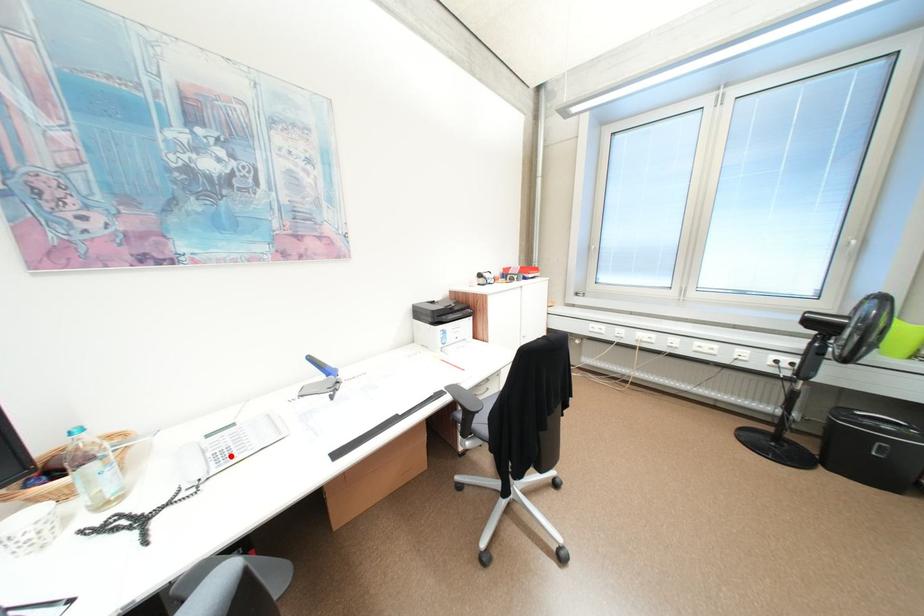
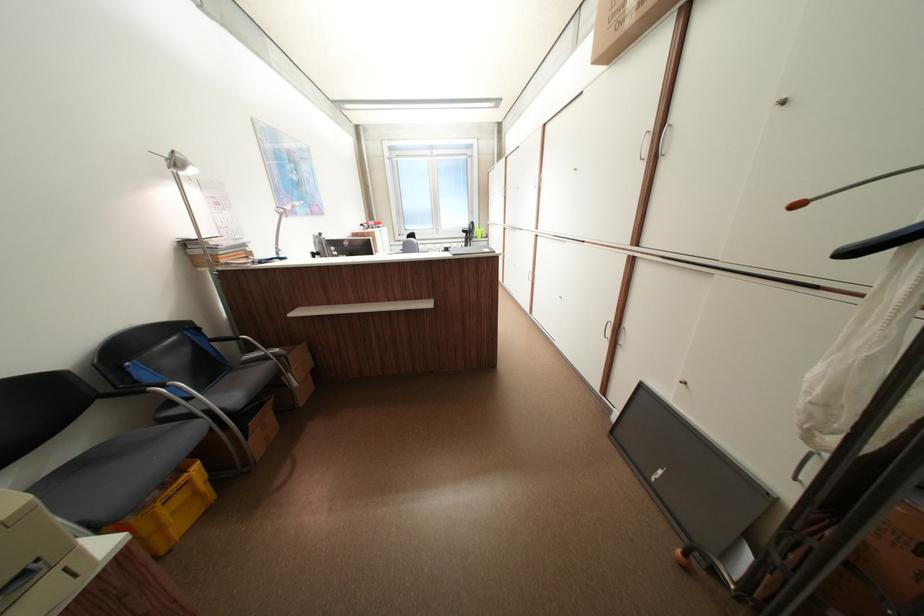
Question: I am providing you with two images of the same scene from different viewpoints. A red point is marked on the first image. At the location where the point appears in image 1, is it still visible in image 2?

Choices:
 (A) Yes
 (B) No

Answer: (B)